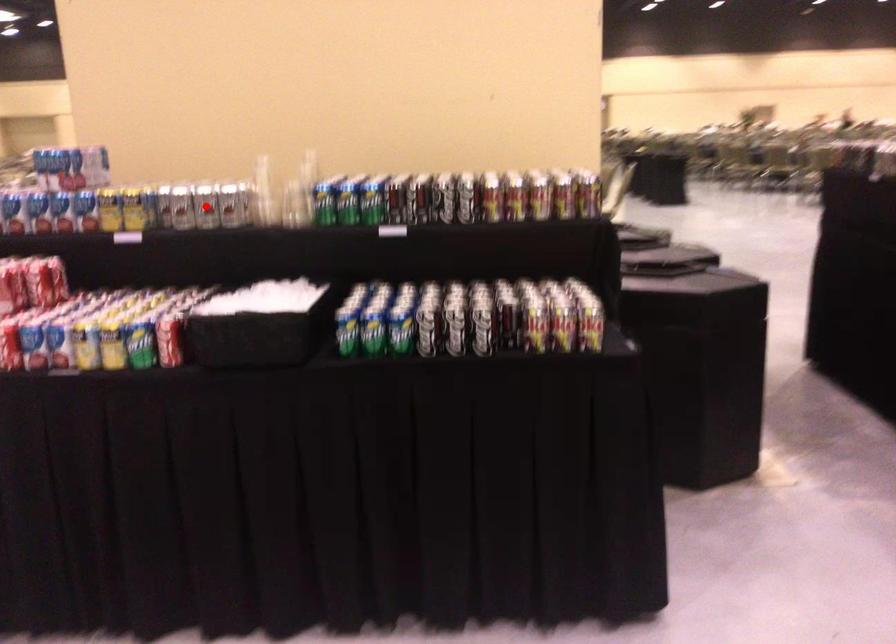
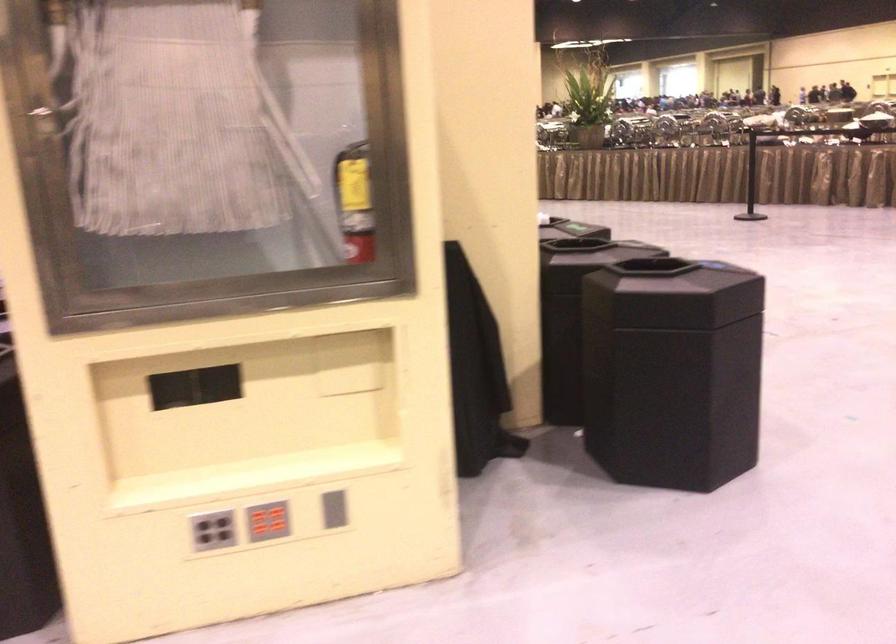
Question: I am providing you with two images of the same scene from different viewpoints. A red point is marked on the first image. At the location where the point appears in image 1, is it still visible in image 2?

Choices:
 (A) Yes
 (B) No

Answer: (B)